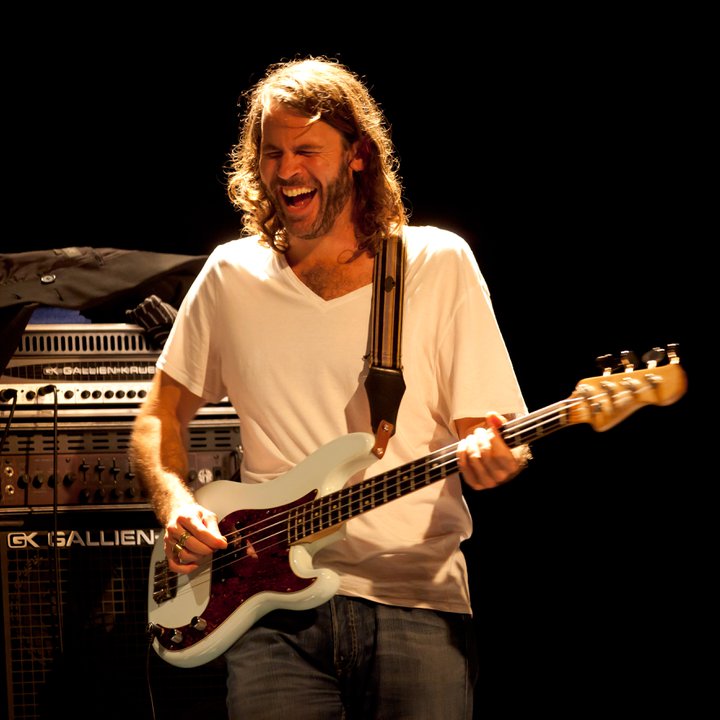
Locate an element on the screen. The image size is (720, 720). speaker is located at coordinates (86, 652).